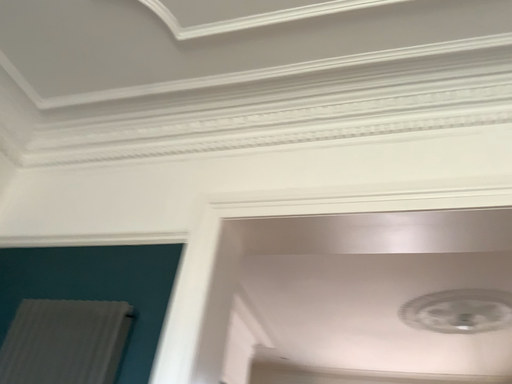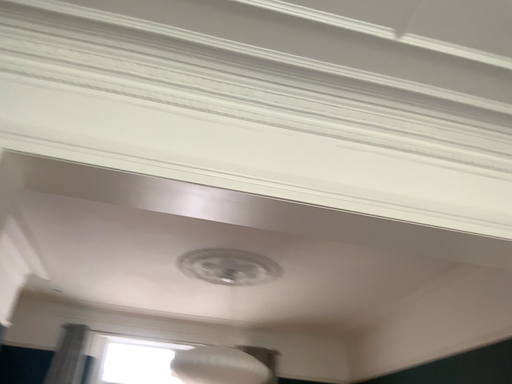
Question: How did the camera likely rotate when shooting the video?

Choices:
 (A) rotated right
 (B) rotated left

Answer: (A)